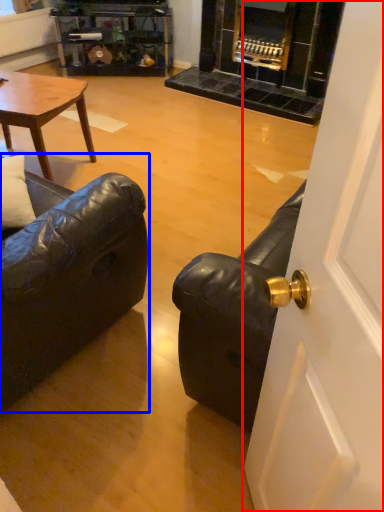
Question: Which object is further to the camera taking this photo, door (highlighted by a red box) or studio couch (highlighted by a blue box)?

Choices:
 (A) door
 (B) studio couch

Answer: (B)